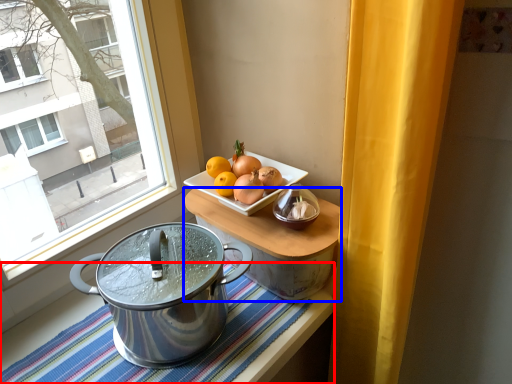
Question: Which object appears closest to the camera in this image, tablecloth (highlighted by a red box) or table (highlighted by a blue box)?

Choices:
 (A) tablecloth
 (B) table

Answer: (A)